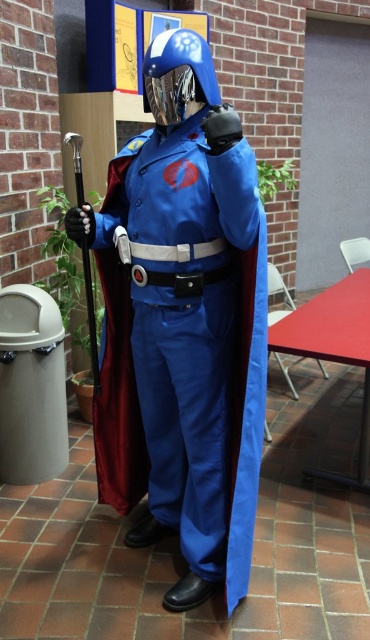
You are a costume designer assessing the fit of the costume. The matte blue suit at center and the blue metallic helmet at center are part of the ensemble. Based on their sizes, which one is taller?

The matte blue suit at center is taller than the blue metallic helmet at center.

You are a costume designer trying to store the matte blue suit at center and the blue metallic helmet at center in a rectangular box. If the box can only accommodate items up to the width of the wider object, which object determines the minimum required width of the box?

The matte blue suit at center has a larger width than the blue metallic helmet at center, so the minimum required width of the box must be at least the width of the matte blue suit at center to accommodate both items.